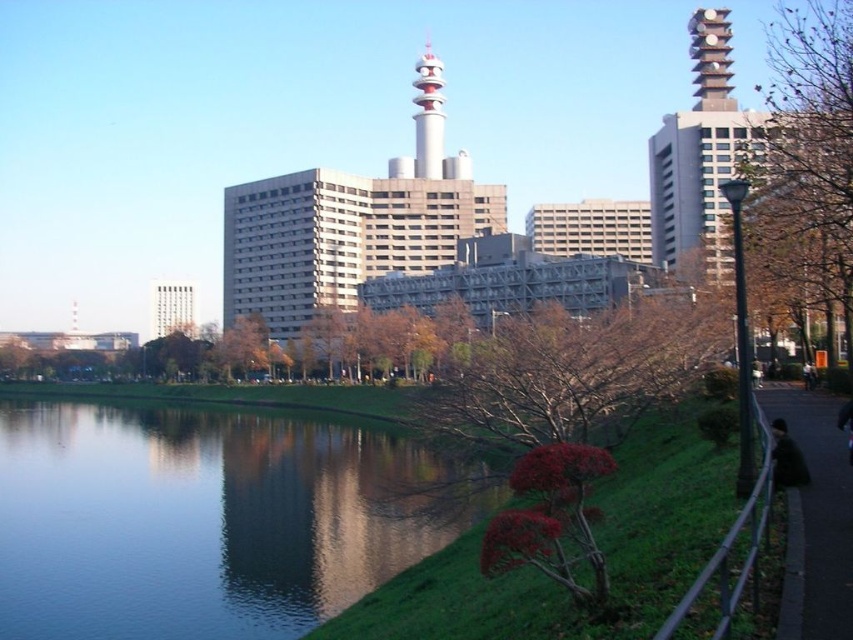
You are a photographer standing at the edge of the paved pathway. You want to capture a photo that includes both the black fabric at lower right and the matte white tower at left. Based on their positions, which object should you focus on first to ensure both are in the frame?

The black fabric at lower right is located below the matte white tower at left, so to include both in the frame, you should focus on the matte white tower at left first as it is higher up, ensuring the lower positioned black fabric at lower right remains within the shot.

You are standing at the point marked as point (805, 160). Looking around, you see bare branches at right. Which direction should you walk to reach the paved pathway where the person is walking?

The point (805, 160) is located on the bare branches at right. To reach the paved pathway where the person is walking, you should walk towards the left, as the pathway is on the opposite side of the embankment from the bare branches.

You are standing at the center of the image and want to locate the bare branches at right. In which direction should you look to see them?

The bare branches at right are located at the right side of the image, so you should look to your right to see them.